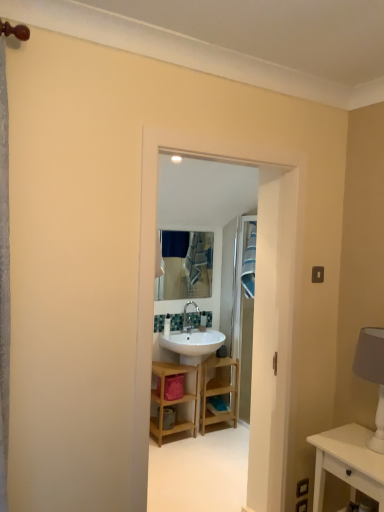
I want to click on blank space situated above white glossy sink at center (from a real-world perspective), so click(x=233, y=141).